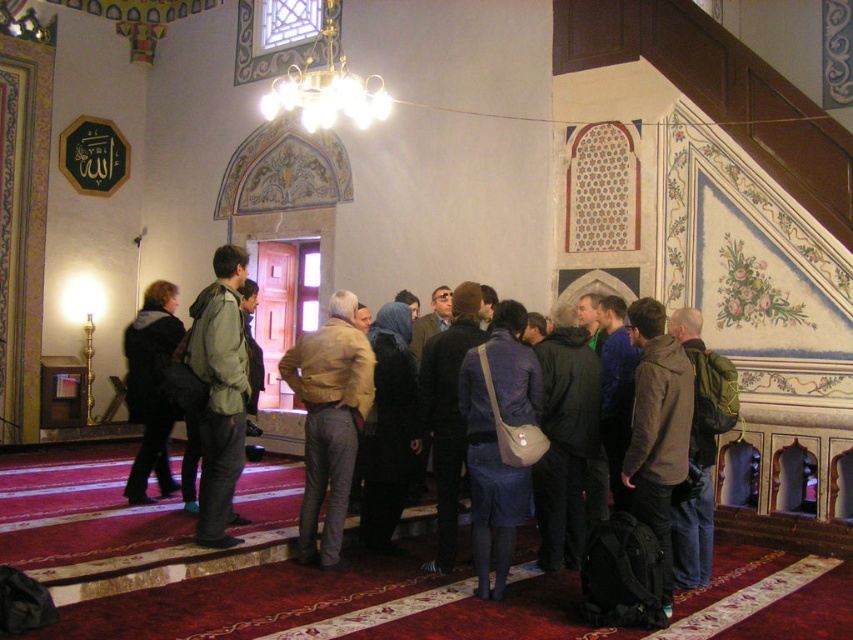
You are standing in the mosque and want to take a photo of the chandelier. The camera you have can focus on objects up to 10 meters away. Is the point where the chandelier is located, which is at point (679, 432), within the camera focus range?

The distance of point (679, 432) from camera is 9.69 meters, so yes, the chandelier at point (679, 432) is within the camera focus range since it is less than 10 meters away.

You are standing in the mosque and see the dark blue fabric headscarf at center and the dark brown leather jacket at center. Which object takes up more space in the scene?

The dark blue fabric headscarf at center takes up more space in the scene as it has a larger size compared to the dark brown leather jacket at center.